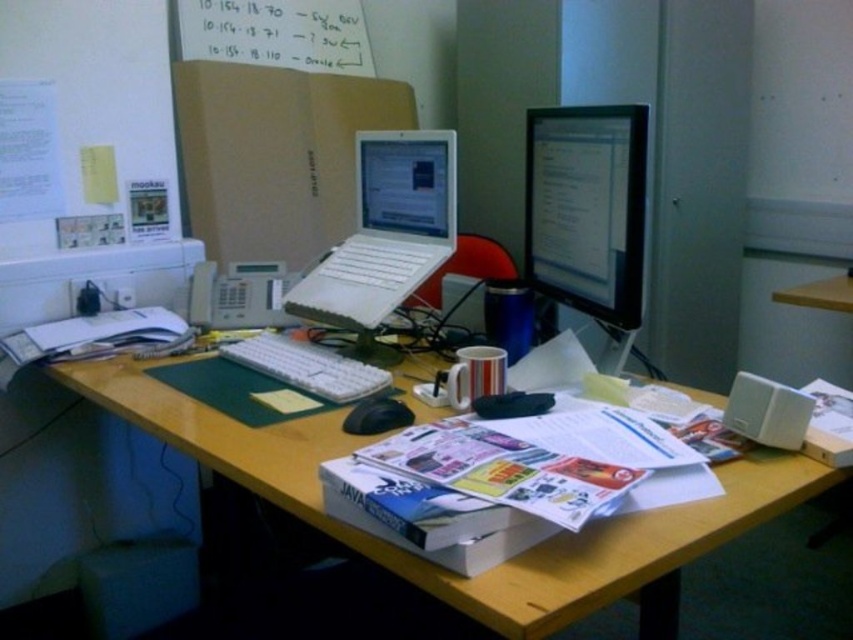
From the picture: You are organizing your desk and want to place the wooden at center and the white plastic keyboard at center on the same shelf. The shelf has a height limit of 10 cm. Can both items fit vertically without exceeding the height limit?

The wooden at center has a greater height compared to the white plastic keyboard at center. If the wooden at center exceeds 10 cm in height, then both items cannot fit. However, if the wooden at center is under 10 cm, both can fit as the keyboard is shorter. Without exact measurements, it is uncertain.

Is the wooden cup at center located at point (498, 564)?

Yes, the wooden cup at center is located at point (498, 564) as described.

You are organizing your desk and want to place a new item between the wooden at center and the white plastic keyboard at center. Based on their positions, which side of the keyboard should you place the new item to ensure it is between them?

Since the wooden at center is to the right of the white plastic keyboard at center, placing the new item to the right side of the keyboard will position it between the two objects.